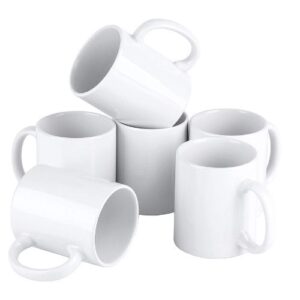
The image size is (300, 300). I want to click on mug handle, so (x=37, y=278), (x=17, y=158), (x=268, y=216), (x=272, y=155), (x=176, y=30).